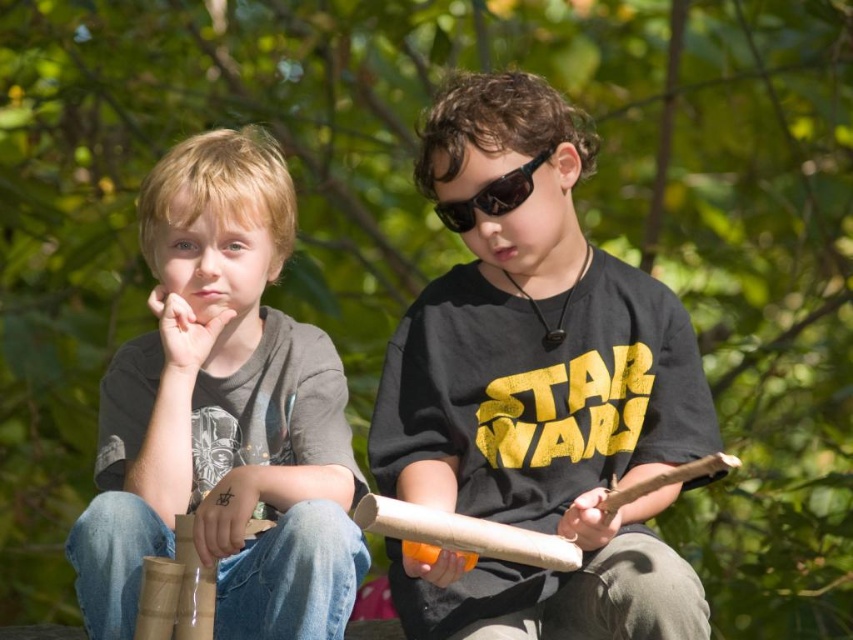
Does black matte t-shirt at center appear under matte gray shirt at left?

No, black matte t-shirt at center is not below matte gray shirt at left.

Is point (520, 282) behind point (216, 298)?

No, (520, 282) is closer to viewer.

Which is in front, point (488, 636) or point (265, 333)?

Point (488, 636) is more forward.

Where is `black matte t-shirt at center`? black matte t-shirt at center is located at coordinates (537, 388).

Is matte gray shirt at left wider than black reflective sunglasses at center?

Yes, matte gray shirt at left is wider than black reflective sunglasses at center.

From the picture: Is matte gray shirt at left in front of black reflective sunglasses at center?

Yes, it is in front of black reflective sunglasses at center.

Is point (160, 166) closer to camera compared to point (509, 180)?

That is False.

In order to click on matte gray shirt at left in this screenshot , I will do `click(223, 413)`.

Based on the photo, is black matte t-shirt at center smaller than black reflective sunglasses at center?

Incorrect, black matte t-shirt at center is not smaller in size than black reflective sunglasses at center.

Find the location of `black matte t-shirt at center`. black matte t-shirt at center is located at coordinates (537, 388).

Image resolution: width=853 pixels, height=640 pixels. In order to click on black matte t-shirt at center in this screenshot , I will do [x=537, y=388].